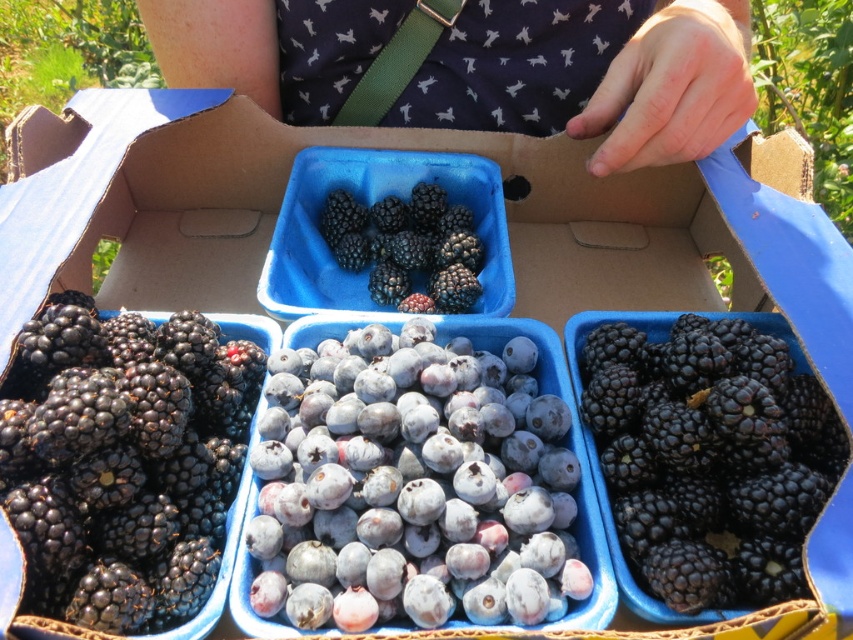
Question: Which of the following is the closest to the observer?

Choices:
 (A) shiny black berries at lower left
 (B) blue dotted shirt at center

Answer: (A)

Question: Can you confirm if shiny black berries at lower left is positioned to the right of blue dotted shirt at center?

Choices:
 (A) yes
 (B) no

Answer: (B)

Question: Considering the real-world distances, which object is closest to the shiny black berries at lower left?

Choices:
 (A) blue matte blueberries at center
 (B) shiny blackberries at center

Answer: (A)

Question: Can you confirm if shiny black berries at lower left is positioned to the left of shiny blackberries at right?

Choices:
 (A) yes
 (B) no

Answer: (A)

Question: Is blue matte blueberries at center closer to camera compared to blue dotted shirt at center?

Choices:
 (A) yes
 (B) no

Answer: (A)

Question: Which is farther from the shiny blackberries at right?

Choices:
 (A) shiny black berries at lower left
 (B) blue dotted shirt at center
 (C) blue matte blueberries at center
 (D) shiny blackberries at center

Answer: (A)